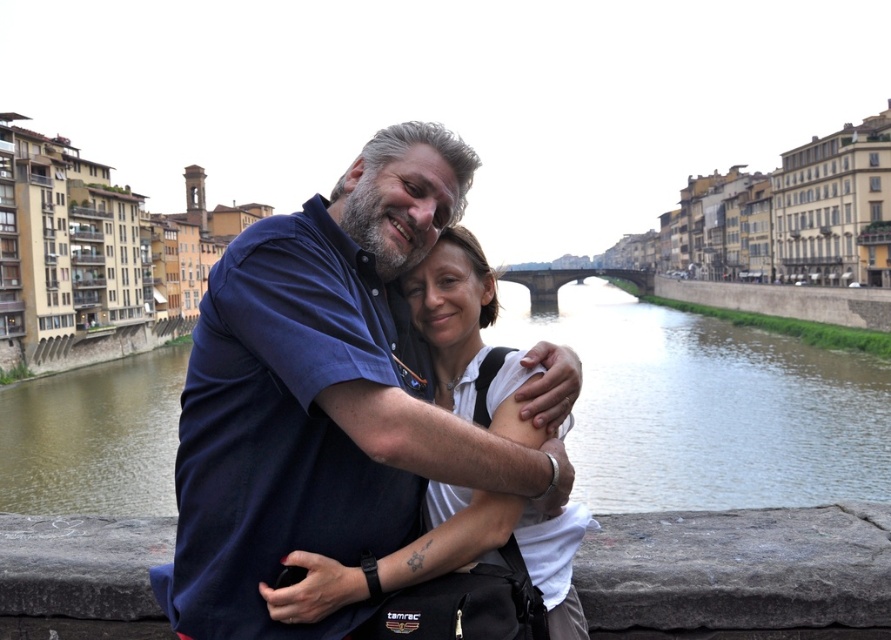
Question: Can you confirm if blue cotton shirt at center is bigger than brown water at center?

Choices:
 (A) yes
 (B) no

Answer: (B)

Question: Can you confirm if blue cotton shirt at center is positioned to the left of brown water at center?

Choices:
 (A) yes
 (B) no

Answer: (A)

Question: Among these objects, which one is farthest from the camera?

Choices:
 (A) blue cotton shirt at center
 (B) brown water at center
 (C) white matte shirt at center

Answer: (B)

Question: In this image, where is brown water at center located relative to white matte shirt at center?

Choices:
 (A) right
 (B) left

Answer: (A)

Question: Which point is closer to the camera taking this photo?

Choices:
 (A) (630, 376)
 (B) (460, 448)

Answer: (B)

Question: Which point is farther to the camera?

Choices:
 (A) (446, 285)
 (B) (578, 362)

Answer: (A)